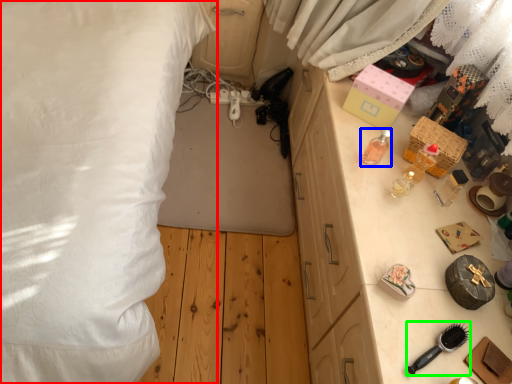
Question: Based on their relative distances, which object is nearer to bed (highlighted by a red box)? Choose from toiletry (highlighted by a blue box) and brush (highlighted by a green box).

Choices:
 (A) toiletry
 (B) brush

Answer: (A)